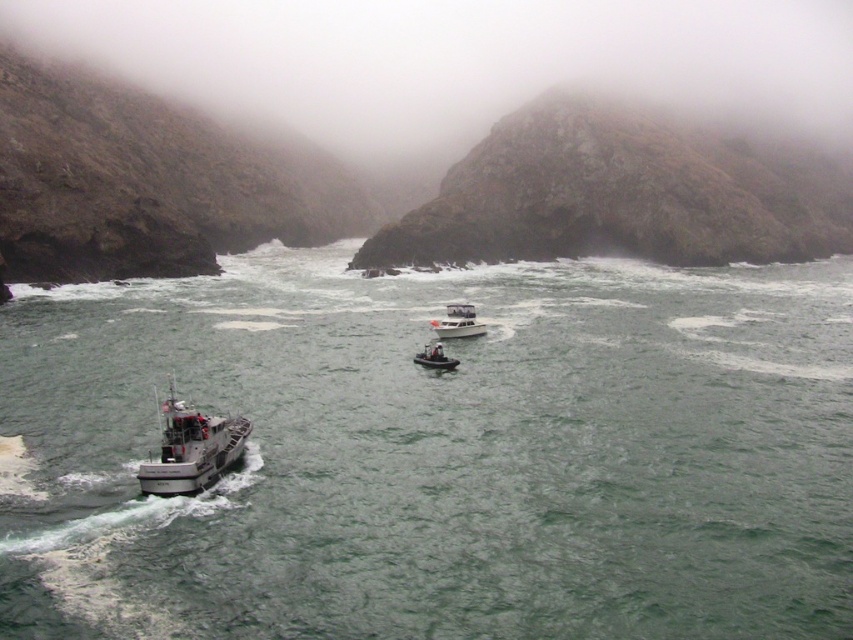
You are a photographer planning to capture the entire scene in one shot. Given that the green matte water at center and the metallic gray boat at lower left must both be visible, which object should you ensure occupies more of the frame horizontally?

The green matte water at center should occupy more of the frame horizontally since its width is larger than the metallic gray boat at lower left.

From the picture: You are a sailor trying to board a vessel from the water. You see the white matte boat at center and the white plastic dinghy at center. Which vessel should you choose if you want to board more easily?

The white plastic dinghy at center has a lower height compared to the white matte boat at center, so it would be easier to board the white plastic dinghy at center.